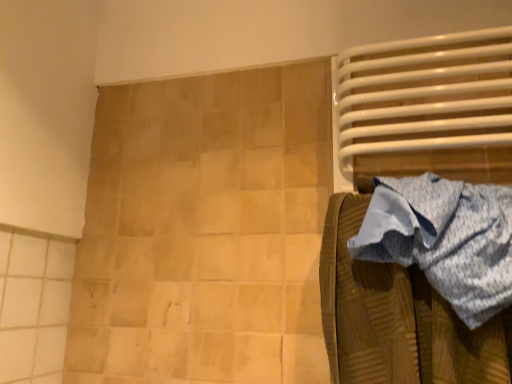
The width and height of the screenshot is (512, 384). Describe the element at coordinates (426, 108) in the screenshot. I see `white metal bed at right` at that location.

I want to click on white metal bed at right, so click(x=426, y=108).

Identify the location of white metal bed at right. The height and width of the screenshot is (384, 512). (426, 108).